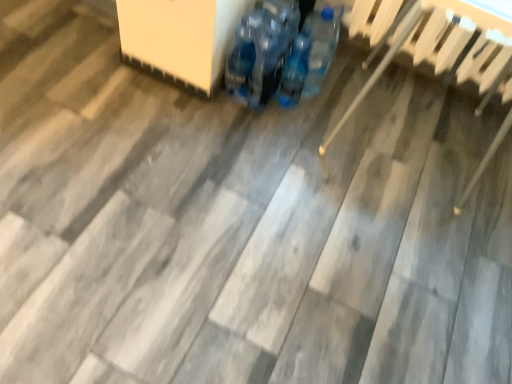
Locate an element on the screen. The width and height of the screenshot is (512, 384). vacant space in front of blue plastic bottles at center is located at coordinates (279, 143).